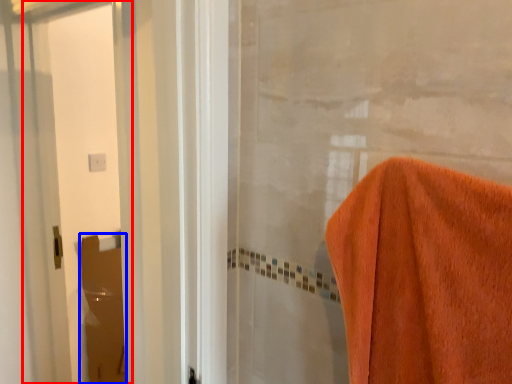
Question: Which of the following is the closest to the observer, screen door (highlighted by a red box) or screen door (highlighted by a blue box)?

Choices:
 (A) screen door
 (B) screen door

Answer: (A)